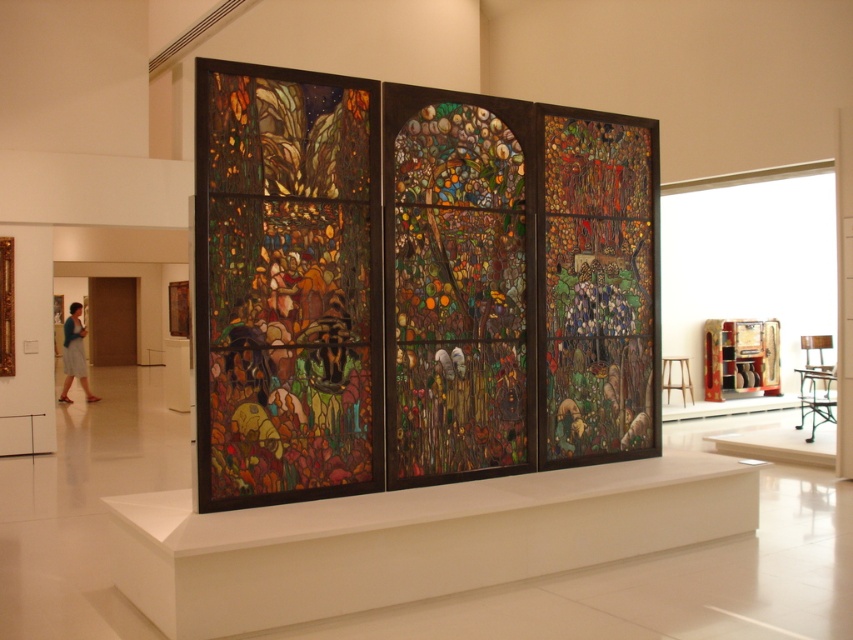
You are an art conservator assessing the dimensions of the stained glass pieces in the gallery. You need to determine which of the two stained glass artworks, the stained glass at center or the stained glass window at center, requires a taller protective casing. Which one do you choose?

The stained glass window at center requires a taller protective casing because it is taller than the stained glass at center, as stated in the description.

You are an interior designer assessing the space for a new piece of furniture. You notice the stained glass window at center and the blue denim skirt at left. Which object is taller, and how might this affect placement of a tall bookshelf nearby?

The stained glass window at center is taller than the blue denim skirt at left. When placing a tall bookshelf nearby, ensure it doesn not obstruct the view of the taller stained glass window at center, which might require positioning the bookshelf to the side or at a distance to maintain visual balance.